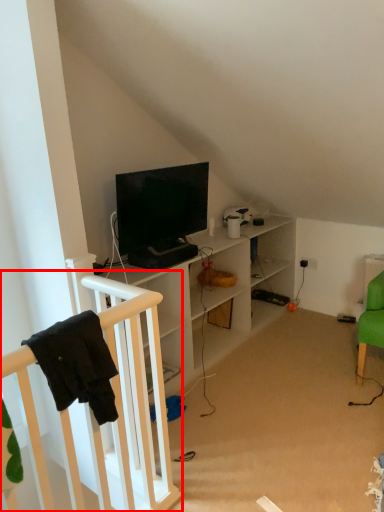
Question: From the image's perspective, considering the relative positions of infant bed (annotated by the red box) and television in the image provided, where is infant bed (annotated by the red box) located with respect to the staircase?

Choices:
 (A) above
 (B) below

Answer: (B)